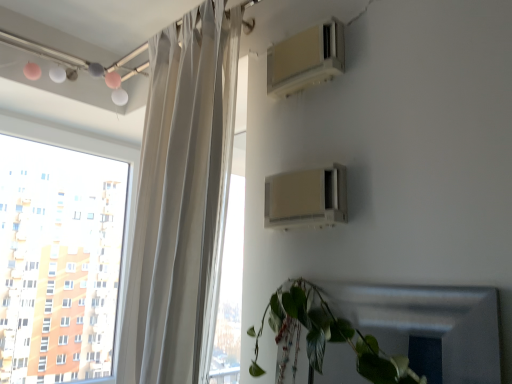
How much space does beige plastic air conditioner at upper center, the 1th air conditioning in the top-to-bottom sequence, occupy horizontally?

6.20 centimeters.

In order to face beige plastic air conditioner at upper center, which is counted as the 2th air conditioning, starting from the bottom, should I rotate leftwards or rightwards?

Turn right approximately 5.661 degrees to face it.

Locate an element on the screen. The width and height of the screenshot is (512, 384). beige plastic air conditioner at upper right, the second air conditioning viewed from the top is located at coordinates (306, 198).

Identify the location of beige plastic air conditioner at upper center, the 1th air conditioning in the top-to-bottom sequence. (306, 59).

From a real-world perspective, is beige plastic air conditioner at upper center, which is counted as the 2th air conditioning, starting from the bottom, located higher than transparent glass window at upper left?

Yes.

Does beige plastic air conditioner at upper center, which is counted as the 2th air conditioning, starting from the bottom, have a lesser width compared to transparent glass window at upper left?

Indeed, beige plastic air conditioner at upper center, which is counted as the 2th air conditioning, starting from the bottom, has a lesser width compared to transparent glass window at upper left.

Is beige plastic air conditioner at upper center, which is counted as the 2th air conditioning, starting from the bottom, facing towards transparent glass window at upper left?

No, beige plastic air conditioner at upper center, which is counted as the 2th air conditioning, starting from the bottom, is not oriented towards transparent glass window at upper left.

Which object is closer to the camera, beige plastic air conditioner at upper center, which is counted as the 2th air conditioning, starting from the bottom, or transparent glass window at upper left?

beige plastic air conditioner at upper center, which is counted as the 2th air conditioning, starting from the bottom, is more forward.

Which of these two, transparent glass window at upper left or green matte leafy plant at lower right, is wider?

With larger width is green matte leafy plant at lower right.

Considering the sizes of transparent glass window at upper left and green matte leafy plant at lower right in the image, is transparent glass window at upper left taller or shorter than green matte leafy plant at lower right?

transparent glass window at upper left is taller than green matte leafy plant at lower right.

Considering the points (46, 262) and (377, 357), which point is behind, point (46, 262) or point (377, 357)?

The point (46, 262) is more distant.

From the image's perspective, is green matte leafy plant at lower right on transparent glass window at upper left?

No, from the image's perspective, green matte leafy plant at lower right is not over transparent glass window at upper left.

Considering the sizes of objects green matte leafy plant at lower right and transparent glass window at upper left in the image provided, who is taller, green matte leafy plant at lower right or transparent glass window at upper left?

With more height is transparent glass window at upper left.

From a real-world perspective, between green matte leafy plant at lower right and transparent glass window at upper left, who is vertically higher?

In real-world perspective, transparent glass window at upper left is above.

How many degrees apart are the facing directions of green matte leafy plant at lower right and transparent glass window at upper left?

Result: There is a 88.1-degree angle between the facing directions of green matte leafy plant at lower right and transparent glass window at upper left.

Is point (136, 328) closer to viewer compared to point (27, 204)?

Yes, it is in front of point (27, 204).

Is white sheer curtain at left at the left side of transparent glass window at upper left?

Incorrect, white sheer curtain at left is not on the left side of transparent glass window at upper left.

Is there a large distance between white sheer curtain at left and transparent glass window at upper left?

white sheer curtain at left is far away from transparent glass window at upper left.

Is white sheer curtain at left inside or outside of transparent glass window at upper left?

white sheer curtain at left cannot be found inside transparent glass window at upper left.

Consider the image. Relative to beige plastic air conditioner at upper center, the 1th air conditioning in the top-to-bottom sequence, is beige plastic air conditioner at upper right, the second air conditioning viewed from the top, in front or behind?

beige plastic air conditioner at upper right, the second air conditioning viewed from the top, is positioned closer to the viewer than beige plastic air conditioner at upper center, the 1th air conditioning in the top-to-bottom sequence.

Is beige plastic air conditioner at upper right, which ranks as the first air conditioning in bottom-to-top order, placed right next to beige plastic air conditioner at upper center, the 1th air conditioning in the top-to-bottom sequence?

They are not placed beside each other.

From a real-world perspective, is beige plastic air conditioner at upper right, which ranks as the first air conditioning in bottom-to-top order, located beneath beige plastic air conditioner at upper center, the 1th air conditioning in the top-to-bottom sequence?

Yes, from a real-world perspective, beige plastic air conditioner at upper right, which ranks as the first air conditioning in bottom-to-top order, is beneath beige plastic air conditioner at upper center, the 1th air conditioning in the top-to-bottom sequence.

Where is `air conditioning to the right of beige plastic air conditioner at upper right, the second air conditioning viewed from the top`? The width and height of the screenshot is (512, 384). air conditioning to the right of beige plastic air conditioner at upper right, the second air conditioning viewed from the top is located at coordinates (306, 59).

From the image's perspective, does beige plastic air conditioner at upper right, the second air conditioning viewed from the top, appear lower than green matte leafy plant at lower right?

Actually, beige plastic air conditioner at upper right, the second air conditioning viewed from the top, appears above green matte leafy plant at lower right in the image.

Does beige plastic air conditioner at upper right, which ranks as the first air conditioning in bottom-to-top order, have a lesser height compared to green matte leafy plant at lower right?

Yes.

Based on their sizes in the image, would you say beige plastic air conditioner at upper right, the second air conditioning viewed from the top, is bigger or smaller than green matte leafy plant at lower right?

Clearly, beige plastic air conditioner at upper right, the second air conditioning viewed from the top, is smaller in size than green matte leafy plant at lower right.

Where is `houseplant lying below the beige plastic air conditioner at upper right, the second air conditioning viewed from the top (from the image's perspective)`? houseplant lying below the beige plastic air conditioner at upper right, the second air conditioning viewed from the top (from the image's perspective) is located at coordinates (323, 338).

Looking at this image, between white sheer curtain at left and beige plastic air conditioner at upper center, the 1th air conditioning in the top-to-bottom sequence, which one has less height?

Standing shorter between the two is beige plastic air conditioner at upper center, the 1th air conditioning in the top-to-bottom sequence.

From the image's perspective, does white sheer curtain at left appear lower than beige plastic air conditioner at upper center, which is counted as the 2th air conditioning, starting from the bottom?

Correct, white sheer curtain at left appears lower than beige plastic air conditioner at upper center, which is counted as the 2th air conditioning, starting from the bottom, in the image.

Considering the sizes of objects white sheer curtain at left and beige plastic air conditioner at upper center, which is counted as the 2th air conditioning, starting from the bottom, in the image provided, who is bigger, white sheer curtain at left or beige plastic air conditioner at upper center, which is counted as the 2th air conditioning, starting from the bottom,?

white sheer curtain at left.

In terms of width, does white sheer curtain at left look wider or thinner when compared to beige plastic air conditioner at upper center, the 1th air conditioning in the top-to-bottom sequence?

white sheer curtain at left is wider than beige plastic air conditioner at upper center, the 1th air conditioning in the top-to-bottom sequence.

Where is `air conditioning that is the 1st object located in front of the transparent glass window at upper left`? Image resolution: width=512 pixels, height=384 pixels. air conditioning that is the 1st object located in front of the transparent glass window at upper left is located at coordinates (306, 59).

I want to click on houseplant below the transparent glass window at upper left (from a real-world perspective), so click(x=323, y=338).

Based on the photo, considering their positions, is white sheer curtain at left positioned closer to transparent glass window at upper left than beige plastic air conditioner at upper center, the 1th air conditioning in the top-to-bottom sequence?

white sheer curtain at left.

When comparing their distances from transparent glass window at upper left, does beige plastic air conditioner at upper right, the second air conditioning viewed from the top, or green matte leafy plant at lower right seem further?

The object further to transparent glass window at upper left is green matte leafy plant at lower right.

When comparing their distances from beige plastic air conditioner at upper right, which ranks as the first air conditioning in bottom-to-top order, does transparent glass window at upper left or green matte leafy plant at lower right seem further?

Among the two, transparent glass window at upper left is located further to beige plastic air conditioner at upper right, which ranks as the first air conditioning in bottom-to-top order.

Which object lies nearer to the anchor point green matte leafy plant at lower right, transparent glass window at upper left or beige plastic air conditioner at upper center, the 1th air conditioning in the top-to-bottom sequence?

beige plastic air conditioner at upper center, the 1th air conditioning in the top-to-bottom sequence, is closer to green matte leafy plant at lower right.

Looking at the image, which one is located further to beige plastic air conditioner at upper right, the second air conditioning viewed from the top, green matte leafy plant at lower right or beige plastic air conditioner at upper center, which is counted as the 2th air conditioning, starting from the bottom?

beige plastic air conditioner at upper center, which is counted as the 2th air conditioning, starting from the bottom, lies further to beige plastic air conditioner at upper right, the second air conditioning viewed from the top, than the other object.

Based on their spatial positions, is beige plastic air conditioner at upper right, the second air conditioning viewed from the top, or beige plastic air conditioner at upper center, which is counted as the 2th air conditioning, starting from the bottom, closer to green matte leafy plant at lower right?

Based on the image, beige plastic air conditioner at upper right, the second air conditioning viewed from the top, appears to be nearer to green matte leafy plant at lower right.

When comparing their distances from beige plastic air conditioner at upper right, the second air conditioning viewed from the top, does green matte leafy plant at lower right or transparent glass window at upper left seem further?

Based on the image, transparent glass window at upper left appears to be further to beige plastic air conditioner at upper right, the second air conditioning viewed from the top.

From the image, which object appears to be farther from green matte leafy plant at lower right, transparent glass window at upper left or beige plastic air conditioner at upper right, which ranks as the first air conditioning in bottom-to-top order?

transparent glass window at upper left.

Identify the location of curtain between transparent glass window at upper left and green matte leafy plant at lower right. (182, 200).

Find the location of a particular element. air conditioning between beige plastic air conditioner at upper center, which is counted as the 2th air conditioning, starting from the bottom, and green matte leafy plant at lower right from top to bottom is located at coordinates (306, 198).

Where is `curtain between transparent glass window at upper left and beige plastic air conditioner at upper right, the second air conditioning viewed from the top`? This screenshot has width=512, height=384. curtain between transparent glass window at upper left and beige plastic air conditioner at upper right, the second air conditioning viewed from the top is located at coordinates (182, 200).

Where is `curtain between beige plastic air conditioner at upper center, the 1th air conditioning in the top-to-bottom sequence, and green matte leafy plant at lower right in the up-down direction`? The width and height of the screenshot is (512, 384). curtain between beige plastic air conditioner at upper center, the 1th air conditioning in the top-to-bottom sequence, and green matte leafy plant at lower right in the up-down direction is located at coordinates (182, 200).